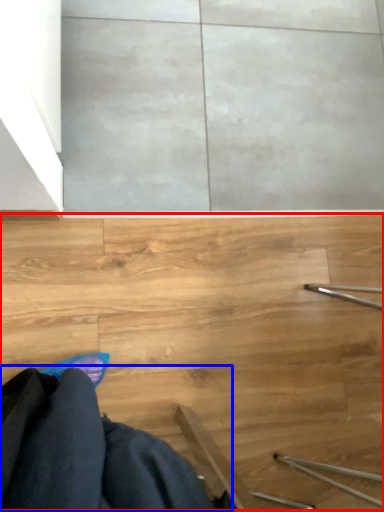
Question: Which object appears farthest to the camera in this image, stairs (highlighted by a red box) or robe (highlighted by a blue box)?

Choices:
 (A) stairs
 (B) robe

Answer: (A)